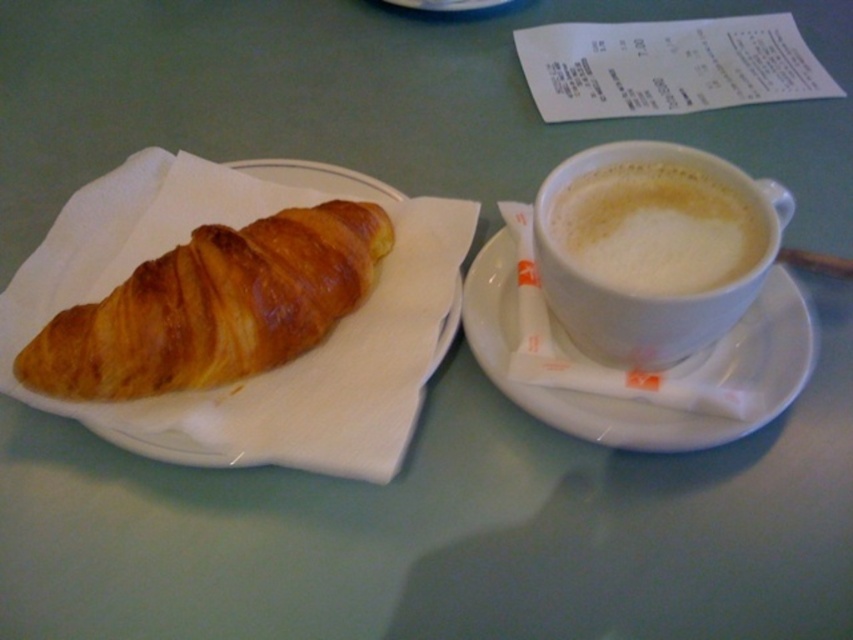
Question: Can you confirm if white frothy latte at right is positioned to the left of white frothy coffee at right?

Choices:
 (A) no
 (B) yes

Answer: (A)

Question: Which point is farther from the camera taking this photo?

Choices:
 (A) (550, 413)
 (B) (564, 204)
 (C) (587, 188)
 (D) (225, 308)

Answer: (C)

Question: Which object is farther from the camera taking this photo?

Choices:
 (A) white ceramic saucer at right
 (B) golden brown flaky croissant at left
 (C) white frothy latte at right

Answer: (B)

Question: Is white frothy latte at right in front of white frothy coffee at right?

Choices:
 (A) yes
 (B) no

Answer: (A)

Question: Which of these objects is positioned farthest from the golden brown flaky croissant at left?

Choices:
 (A) white frothy latte at right
 (B) white ceramic saucer at right
 (C) white frothy coffee at right

Answer: (C)

Question: Is golden brown flaky croissant at left further to camera compared to white frothy coffee at right?

Choices:
 (A) yes
 (B) no

Answer: (A)